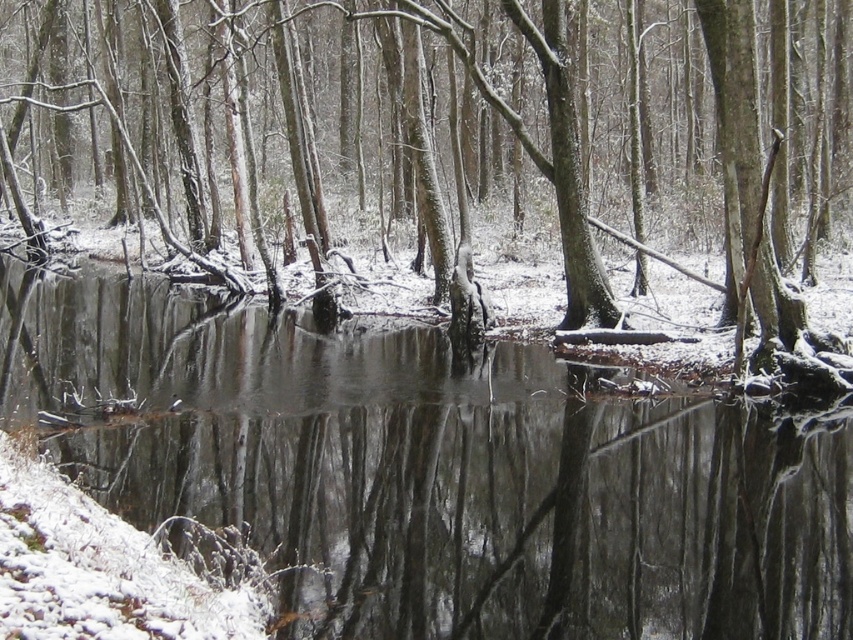
You are an artist planning to paint the winter scene. You want to ensure the clear water at center and smooth bark tree at center are proportionally accurate. Which object should you paint larger?

The smooth bark tree at center should be painted larger because it occupies more space than the clear water at center according to the description.

You are planning to cross the stream using the natural bridge formed by the branches. The smooth bark tree at center has a width of 30 cm. Can the clear water at center, which you need to step over, be crossed safely if your maximum step width is 25 cm?

The clear water at center has a width less than the smooth bark tree at center, which is 30 cm. Therefore, the water is narrower than 30 cm. Since your maximum step width is 25 cm, you can safely cross the clear water at center as it is within your stepping capability.